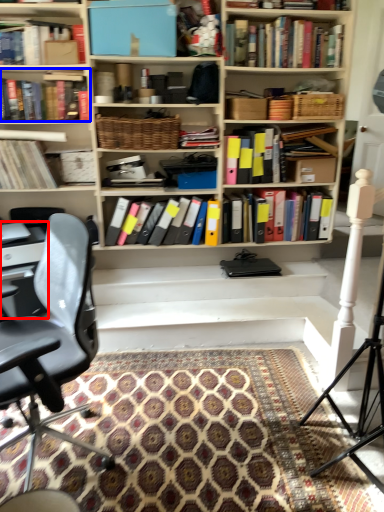
Question: Which of the following is the closest to the observer, computer desk (highlighted by a red box) or book (highlighted by a blue box)?

Choices:
 (A) computer desk
 (B) book

Answer: (A)